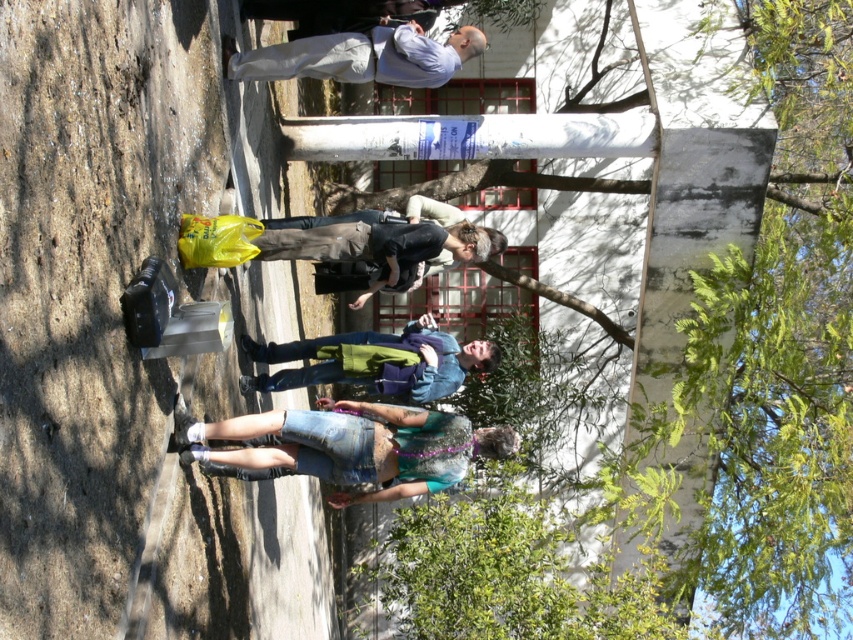
Question: Is denim shorts at lower center to the left of green fabric jacket at center from the viewer's perspective?

Choices:
 (A) yes
 (B) no

Answer: (B)

Question: Can you confirm if denim shorts at lower center is bigger than green fabric jacket at center?

Choices:
 (A) yes
 (B) no

Answer: (B)

Question: Which of the following is the closest to the observer?

Choices:
 (A) denim shorts at lower center
 (B) green fabric jacket at center

Answer: (A)

Question: Does denim shorts at lower center have a greater width compared to green fabric jacket at center?

Choices:
 (A) yes
 (B) no

Answer: (B)

Question: Among these points, which one is farthest from the camera?

Choices:
 (A) (418, 410)
 (B) (405, 353)

Answer: (B)